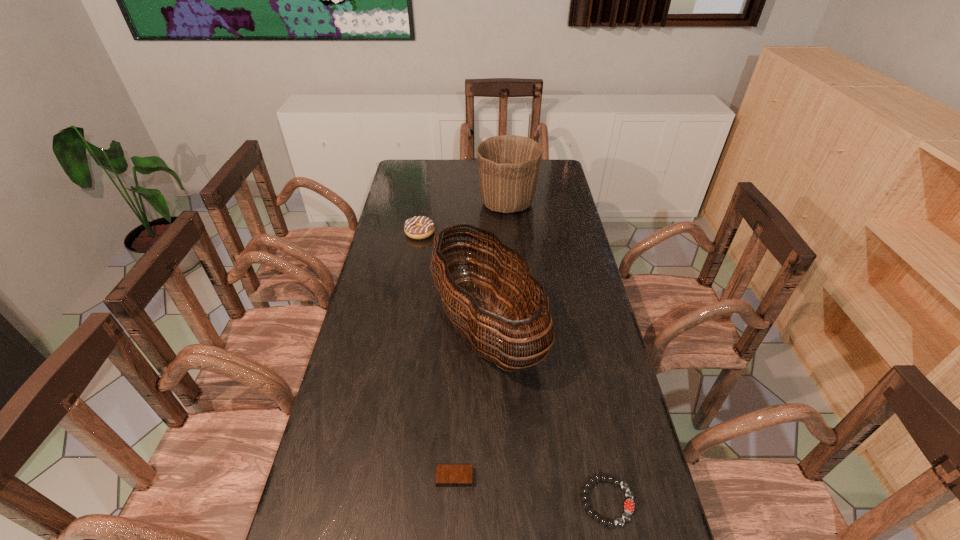
You are a GUI agent. You are given a task and a screenshot of the screen. Output one action in this format:
    pyautogui.click(x=<x>, y=<y>)
    Task: Click on the free spot between the alarm clock and the bracelet
    Image resolution: width=960 pixels, height=540 pixels.
    Given the screenshot: What is the action you would take?
    pyautogui.click(x=531, y=490)

Locate an element on the screen. This screenshot has width=960, height=540. free space between the bracelet and the third nearest object is located at coordinates (547, 415).

Find the location of a particular element. The width and height of the screenshot is (960, 540). empty space that is in between the flowerpot and the fourth nearest object is located at coordinates (464, 218).

The height and width of the screenshot is (540, 960). I want to click on free space between the third nearest object and the bracelet, so click(547, 415).

The height and width of the screenshot is (540, 960). Find the location of `free space between the third farthest object and the bracelet`. free space between the third farthest object and the bracelet is located at coordinates (547, 415).

In order to click on empty location between the doughnut and the flowerpot in this screenshot , I will do tap(464, 218).

Locate which object ranks third in proximity to the third tallest object. Please provide its 2D coordinates. Your answer should be formatted as a tuple, i.e. [(x, y)], where the tuple contains the x and y coordinates of a point satisfying the conditions above.

[(446, 475)]

Select which object appears as the closest to the bracelet. Please provide its 2D coordinates. Your answer should be formatted as a tuple, i.e. [(x, y)], where the tuple contains the x and y coordinates of a point satisfying the conditions above.

[(481, 325)]

Find the location of a particular element. The width and height of the screenshot is (960, 540). free space that satisfies the following two spatial constraints: 1. on the front face of the alarm clock; 2. on the left side of the bracelet is located at coordinates (454, 501).

Image resolution: width=960 pixels, height=540 pixels. What are the coordinates of `vacant area that satisfies the following two spatial constraints: 1. on the front face of the alarm clock; 2. on the left side of the bracelet` in the screenshot? It's located at pos(454,501).